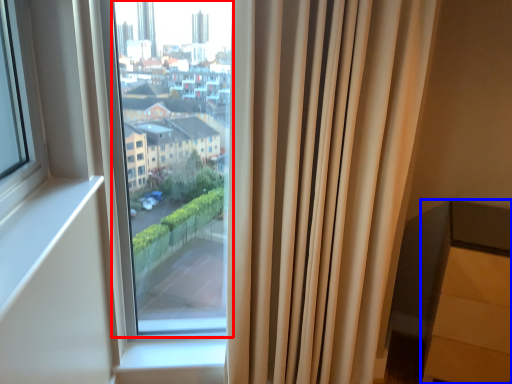
Question: Which object is further to the camera taking this photo, bay window (highlighted by a red box) or furniture (highlighted by a blue box)?

Choices:
 (A) bay window
 (B) furniture

Answer: (B)